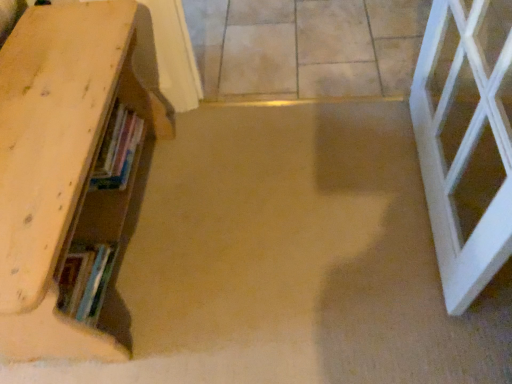
The height and width of the screenshot is (384, 512). I want to click on blank space situated above wooden bookshelf at left (from a real-world perspective), so click(47, 100).